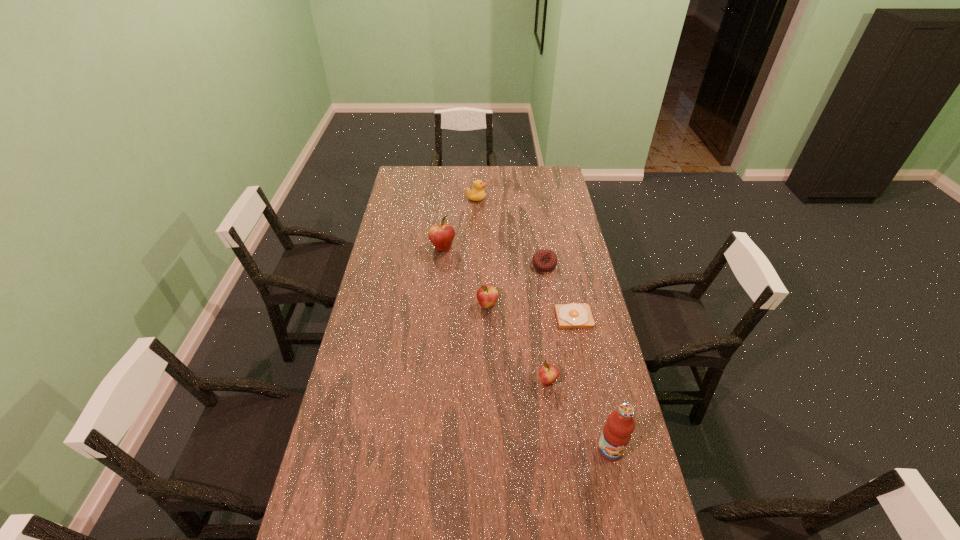
Identify the location of the leftmost object. (441, 235).

At what (x,y) coordinates should I click in order to perform the action: click on the second tallest object. Please return your answer as a coordinate pair (x, y). This screenshot has height=540, width=960. Looking at the image, I should click on (441, 235).

Locate an element on the screen. The image size is (960, 540). the second apple from right to left is located at coordinates (487, 295).

Image resolution: width=960 pixels, height=540 pixels. I want to click on the second tallest apple, so click(x=487, y=295).

Locate an element on the screen. This screenshot has width=960, height=540. the shortest apple is located at coordinates (548, 374).

This screenshot has height=540, width=960. In order to click on the nearest apple in this screenshot , I will do `click(548, 374)`.

I want to click on the farthest object, so click(477, 194).

Identify the location of toast. (573, 315).

The image size is (960, 540). I want to click on fruit juice, so click(617, 432).

Locate an element on the screen. the tallest object is located at coordinates (617, 432).